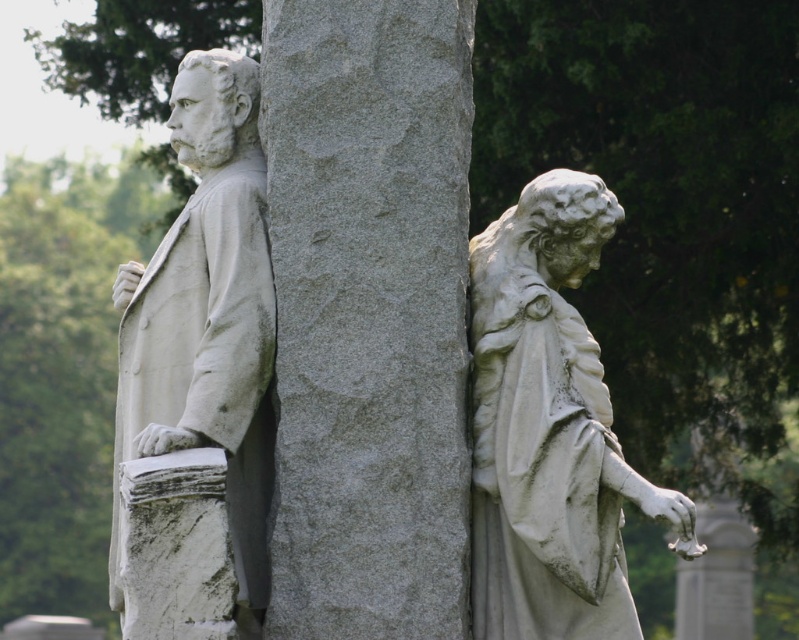
Question: Is gray stone column at center behind white marble statue at left?

Choices:
 (A) yes
 (B) no

Answer: (A)

Question: Which of the following is the closest to the observer?

Choices:
 (A) (260, 424)
 (B) (265, 51)
 (C) (483, 598)

Answer: (C)

Question: Does white marble statue at right have a lesser width compared to white marble statue at left?

Choices:
 (A) yes
 (B) no

Answer: (A)

Question: Estimate the real-world distances between objects in this image. Which object is farther from the gray stone column at center?

Choices:
 (A) white marble statue at left
 (B) white marble statue at right

Answer: (A)

Question: Which point is farther to the camera?

Choices:
 (A) (247, 444)
 (B) (603, 413)

Answer: (A)

Question: Is white marble statue at right positioned behind white marble statue at left?

Choices:
 (A) yes
 (B) no

Answer: (A)